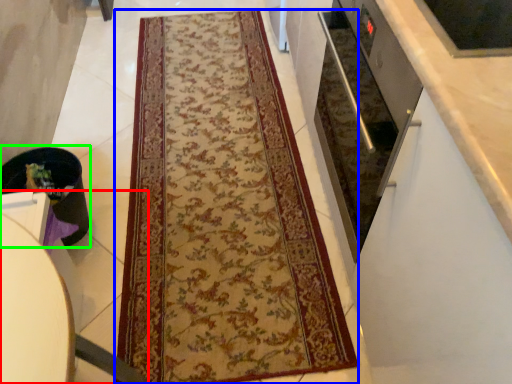
Question: Which is farther away from furniture (highlighted by a red box)? mat (highlighted by a blue box) or appliance (highlighted by a green box)?

Choices:
 (A) mat
 (B) appliance

Answer: (A)